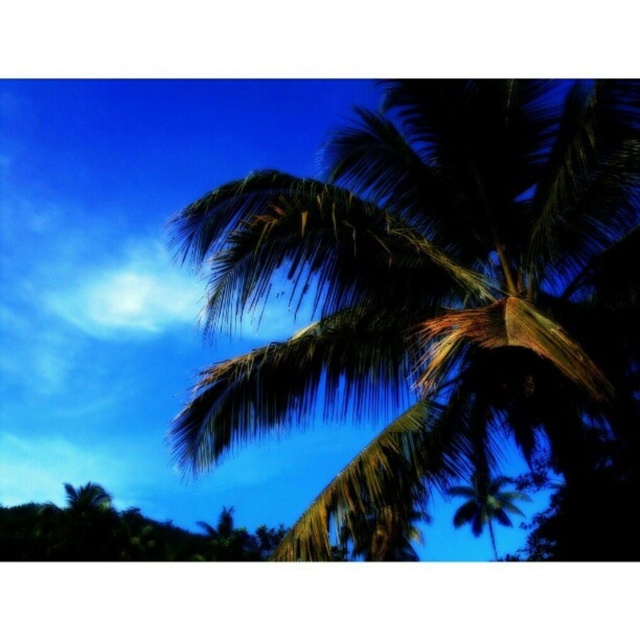
Does dark green leafy coconut tree at upper right have a lesser width compared to green leafy palm tree at center?

In fact, dark green leafy coconut tree at upper right might be wider than green leafy palm tree at center.

This screenshot has height=640, width=640. Identify the location of dark green leafy coconut tree at upper right. (442, 304).